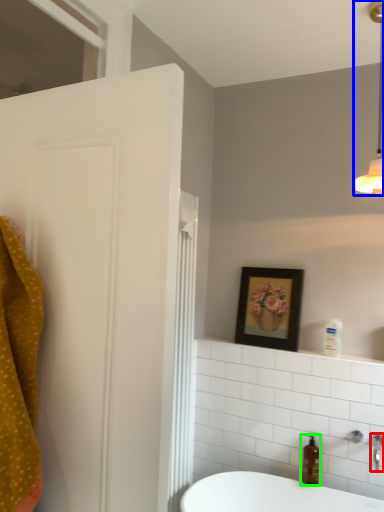
Question: Based on their relative distances, which object is nearer to tap (highlighted by a red box)? Choose from light fixture (highlighted by a blue box) and soap dispenser (highlighted by a green box).

Choices:
 (A) light fixture
 (B) soap dispenser

Answer: (B)